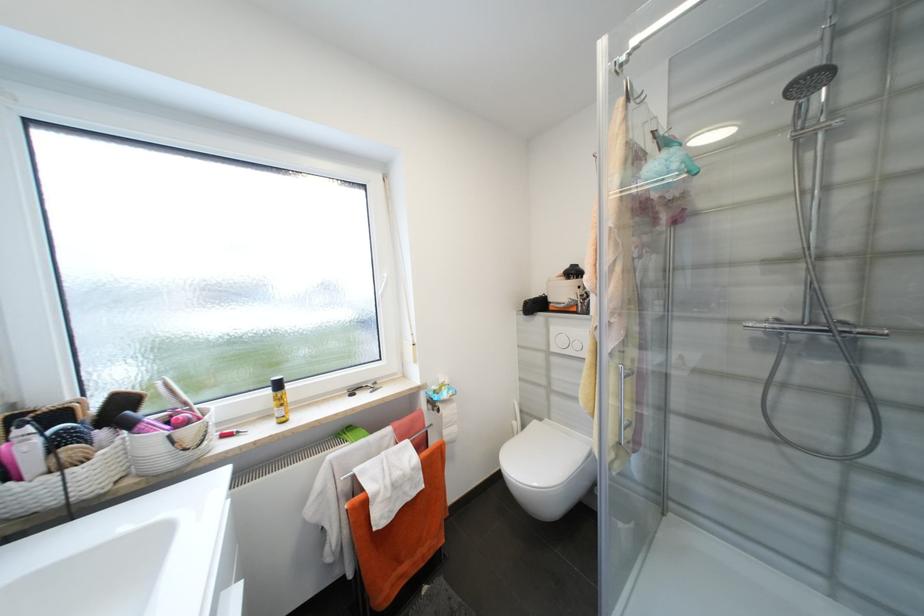
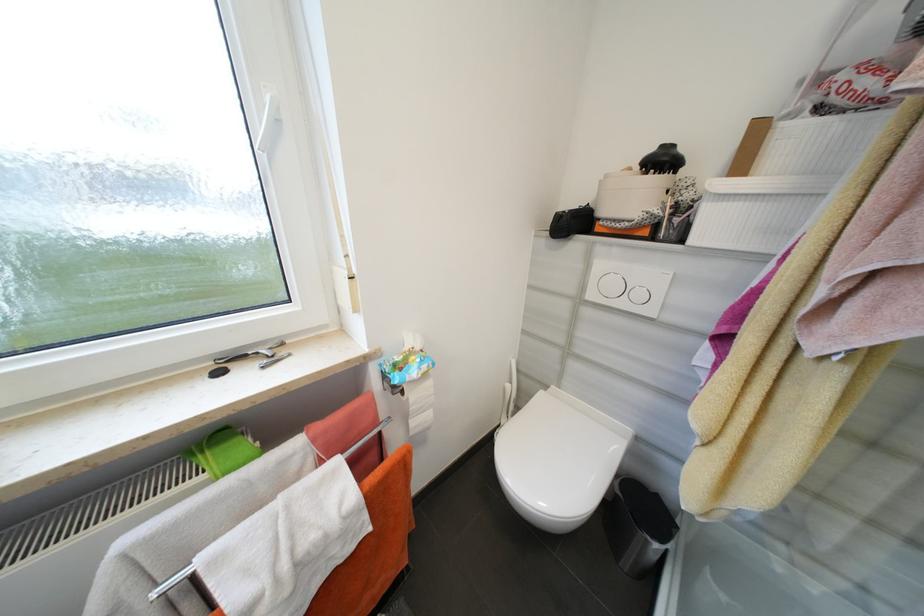
Find the pixel in the second image that matches the point at 580,300 in the first image.

(663, 213)